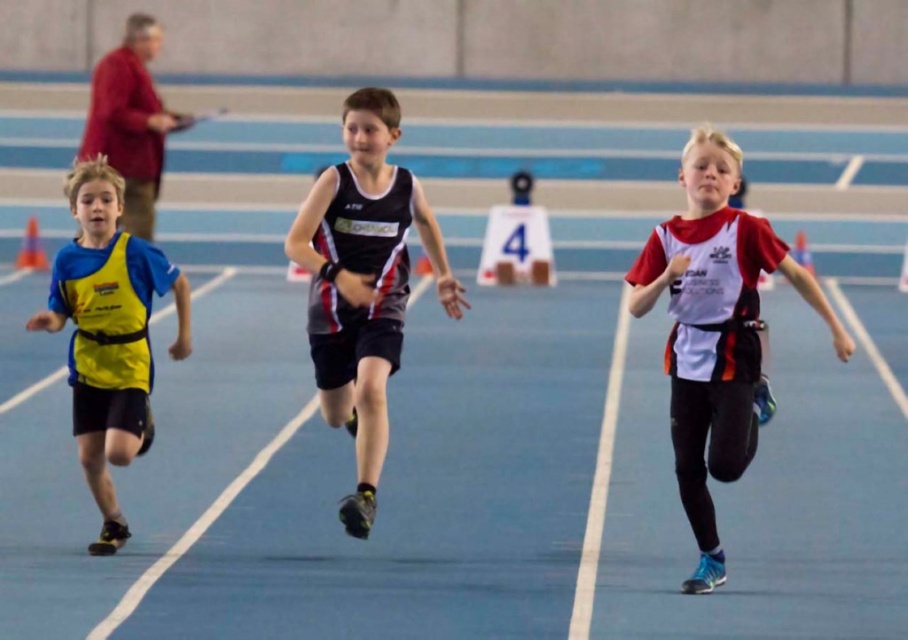
Does white matte jersey at center appear over black matte running suit at center?

No.

Who is more forward, (x=706, y=131) or (x=324, y=170)?

Point (x=706, y=131) is in front.

Image resolution: width=908 pixels, height=640 pixels. I want to click on white matte jersey at center, so click(x=716, y=332).

From the picture: Can you confirm if black matte running suit at center is positioned to the right of yellow fabric vest at left?

Indeed, black matte running suit at center is positioned on the right side of yellow fabric vest at left.

Does point (321, 180) come behind point (146, 436)?

No, (321, 180) is in front of (146, 436).

Who is more distant from viewer, (292, 252) or (122, 445)?

Point (292, 252)

Image resolution: width=908 pixels, height=640 pixels. I want to click on black matte running suit at center, so click(x=363, y=284).

Is point (817, 285) positioned behind point (89, 225)?

No, (817, 285) is closer to viewer.

Is white matte jersey at center above yellow fabric vest at left?

No.

At what (x,y) coordinates should I click in order to perform the action: click on white matte jersey at center. Please return your answer as a coordinate pair (x, y). Looking at the image, I should click on (716, 332).